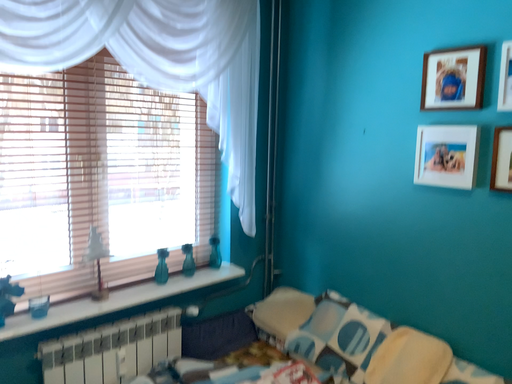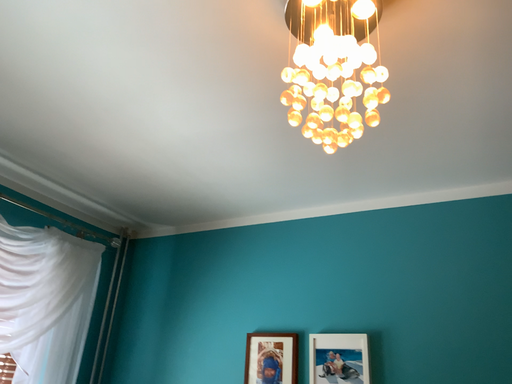
Question: Which way did the camera rotate in the video?

Choices:
 (A) rotated right
 (B) rotated left

Answer: (A)